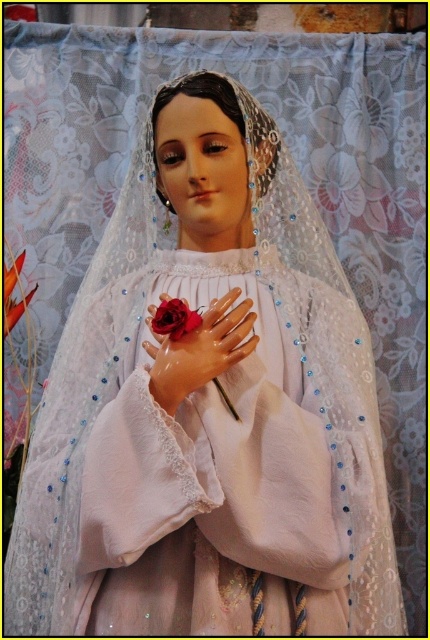
Can you confirm if matte porcelain hand at center is smaller than matte red rose at center?

No.

Which is in front, point (202, 371) or point (190, 328)?

Positioned in front is point (190, 328).

Find the location of a particular element. matte porcelain hand at center is located at coordinates (199, 349).